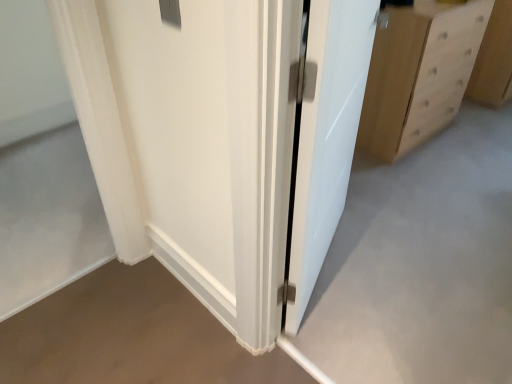
Image resolution: width=512 pixels, height=384 pixels. Identify the location of empty space that is to the right of white sheer curtain at left. (135, 294).